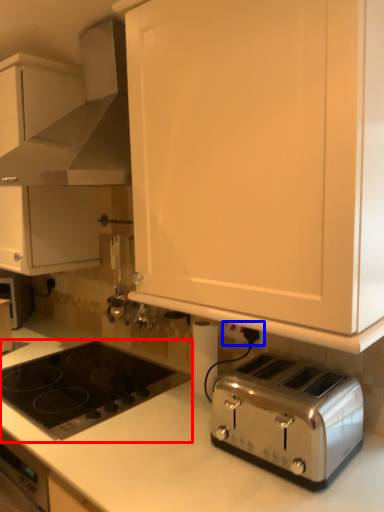
Question: Which object is closer to the camera taking this photo, gas stove (highlighted by a red box) or electric outlet (highlighted by a blue box)?

Choices:
 (A) gas stove
 (B) electric outlet

Answer: (A)